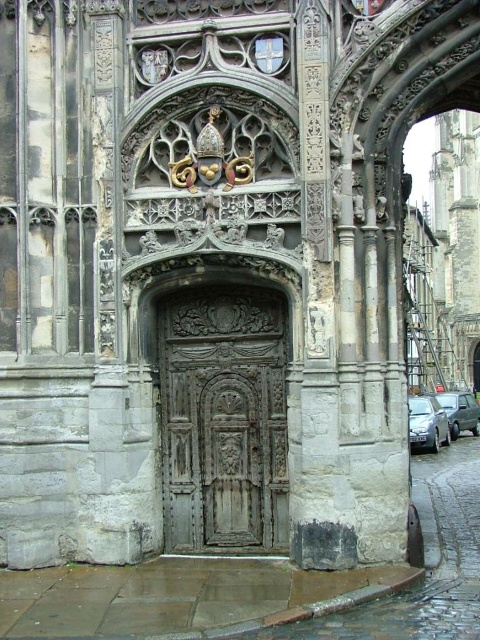
Who is shorter, rusty metal door at center or metallic silver van at lower right?

With less height is metallic silver van at lower right.

Which is in front, point (207, 374) or point (437, 392)?

Point (207, 374) is in front.

Find the location of a particular element. The height and width of the screenshot is (640, 480). rusty metal door at center is located at coordinates (224, 419).

Can you confirm if rusty metal door at center is positioned above silver metallic car at lower right?

Yes.

Who is higher up, rusty metal door at center or silver metallic car at lower right?

rusty metal door at center

Measure the distance between rusty metal door at center and camera.

rusty metal door at center and camera are 44.48 meters apart.

Identify the location of rusty metal door at center. (224, 419).

Which is in front, point (410, 442) or point (453, 424)?

Point (410, 442) is more forward.

Is point (446, 436) more distant than point (470, 406)?

No, (446, 436) is in front of (470, 406).

Is point (430, 442) closer to camera compared to point (463, 413)?

Yes.

Locate an element on the screen. Image resolution: width=480 pixels, height=640 pixels. silver metallic car at lower right is located at coordinates (427, 422).